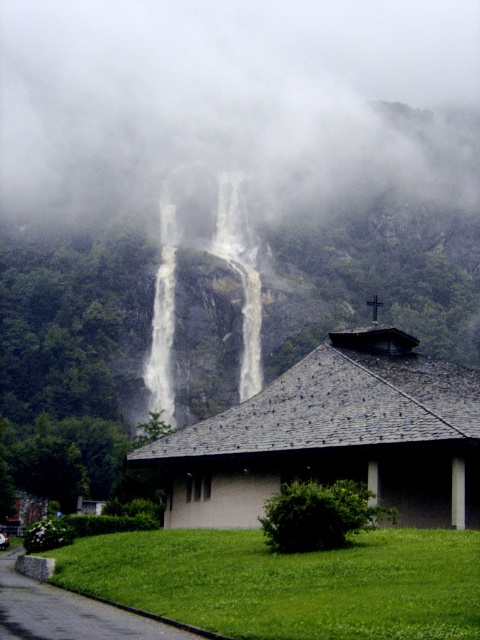
Between foggy mist at center and white frothy water at center, which one is positioned lower?

Result: white frothy water at center

From the picture: Does foggy mist at center have a larger size compared to white frothy water at center?

Yes.

Does point (99, 205) come behind point (241, 332)?

Yes, point (99, 205) is behind point (241, 332).

This screenshot has height=640, width=480. What are the coordinates of `foggy mist at center` in the screenshot? It's located at (232, 100).

Does white textured waterfall at center have a smaller size compared to white smooth waterfall at center?

No.

Is white textured waterfall at center shorter than white smooth waterfall at center?

No, white textured waterfall at center is not shorter than white smooth waterfall at center.

Between point (244, 292) and point (168, 342), which one is positioned behind?

The point (244, 292) is more distant.

Where is `white textured waterfall at center`? The image size is (480, 640). white textured waterfall at center is located at coordinates (240, 275).

Between foggy mist at center and gray slate roof hut at center, which one has less height?

gray slate roof hut at center is shorter.

Which is in front, point (155, 138) or point (295, 464)?

Point (295, 464) is in front.

Is point (192, 22) farther from camera compared to point (273, 456)?

Yes, it is behind point (273, 456).

This screenshot has height=640, width=480. I want to click on foggy mist at center, so click(232, 100).